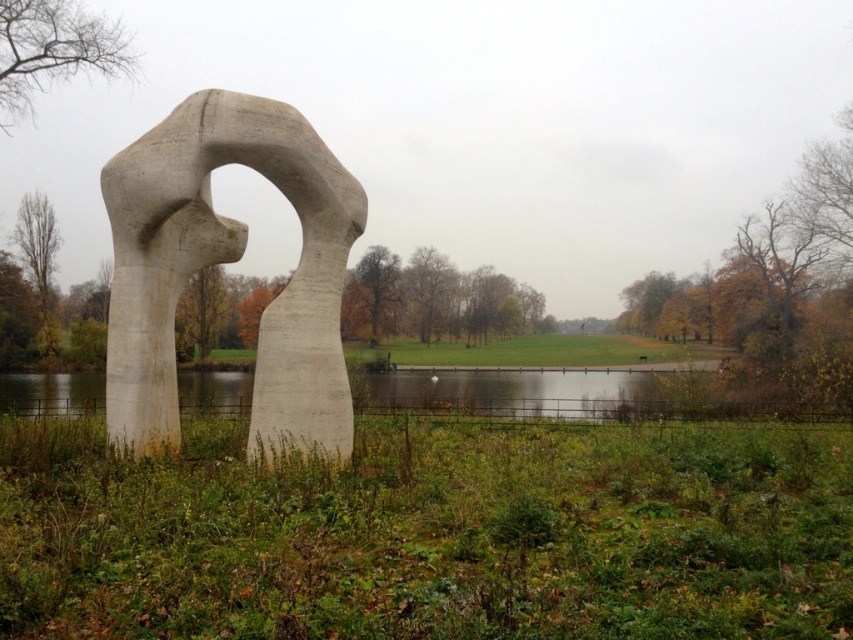
Consider the image. Can you confirm if white concrete sculpture at center is positioned above transparent water at center?

Yes.

Which is behind, point (349, 244) or point (601, 376)?

Positioned behind is point (601, 376).

Where is `white concrete sculpture at center`? white concrete sculpture at center is located at coordinates (225, 262).